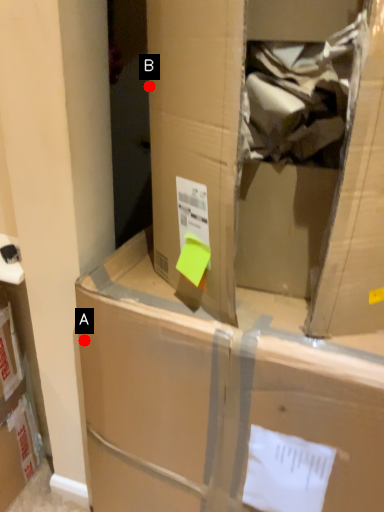
Question: Two points are circled on the image, labeled by A and B beside each circle. Which point is closer to the camera?

Choices:
 (A) A is closer
 (B) B is closer

Answer: (B)